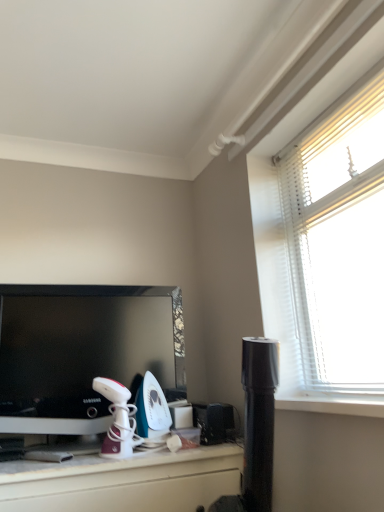
Question: In terms of width, does teal glossy iron at center, acting as the 2th appliance starting from the right, look wider or thinner when compared to black glossy television at left?

Choices:
 (A) thin
 (B) wide

Answer: (A)

Question: From a real-world perspective, relative to black glossy television at left, is teal glossy iron at center, acting as the 2th appliance starting from the right, vertically above or below?

Choices:
 (A) above
 (B) below

Answer: (B)

Question: Estimate the real-world distances between objects in this image. Which object is farther from the white glossy iron at center, arranged as the third appliance when viewed from the right?

Choices:
 (A) teal glossy iron at center, the second appliance positioned from the left
 (B) black plastic speaker at lower center, which ranks as the third appliance in left-to-right order
 (C) black glossy television at left

Answer: (B)

Question: Based on their relative distances, which object is nearer to the white glossy iron at center, arranged as the third appliance when viewed from the right?

Choices:
 (A) teal glossy iron at center, the second appliance positioned from the left
 (B) black plastic speaker at lower center, which ranks as the third appliance in left-to-right order
 (C) black glossy television at left

Answer: (A)